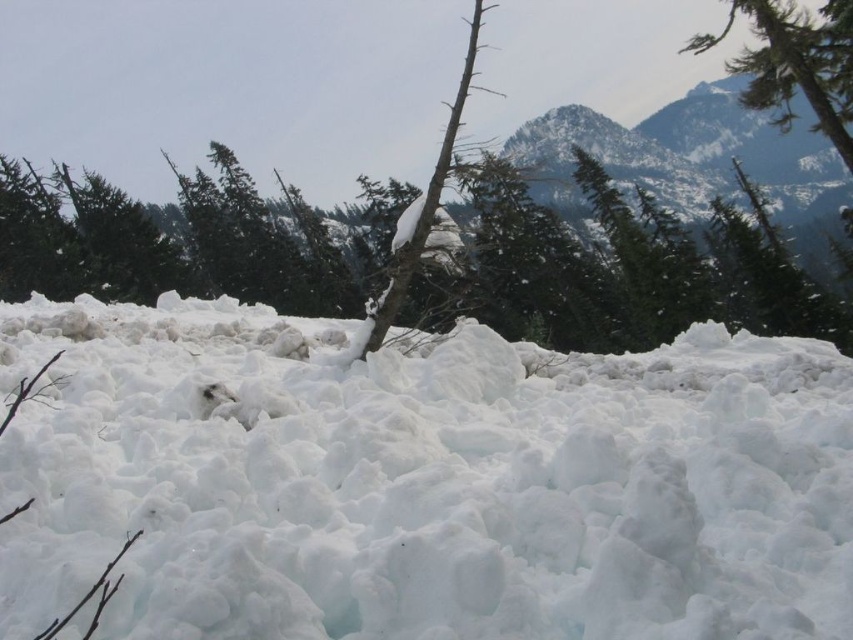
Is white fluffy snow at center in front of snowy bark tree at center?

Yes, it is.

From the picture: Who is more distant from viewer, (352, 520) or (129, 275)?

The point (129, 275) is more distant.

Where is `white fluffy snow at center`? white fluffy snow at center is located at coordinates (419, 481).

What do you see at coordinates (791, 67) in the screenshot? The image size is (853, 640). I see `green textured tree at upper right` at bounding box center [791, 67].

Can you confirm if green textured tree at upper right is positioned to the left of snow-covered branch at center?

In fact, green textured tree at upper right is to the right of snow-covered branch at center.

Is point (793, 8) positioned after point (469, 76)?

Yes, point (793, 8) is behind point (469, 76).

At what (x,y) coordinates should I click in order to perform the action: click on green textured tree at upper right. Please return your answer as a coordinate pair (x, y). Image resolution: width=853 pixels, height=640 pixels. Looking at the image, I should click on (791, 67).

Where is `white fluffy snow at center`? Image resolution: width=853 pixels, height=640 pixels. white fluffy snow at center is located at coordinates (419, 481).

Based on the photo, who is positioned more to the right, white fluffy snow at center or green textured tree at upper right?

green textured tree at upper right is more to the right.

Is point (398, 506) positioned after point (775, 42)?

No, (398, 506) is in front of (775, 42).

This screenshot has height=640, width=853. Find the location of `white fluffy snow at center`. white fluffy snow at center is located at coordinates (419, 481).